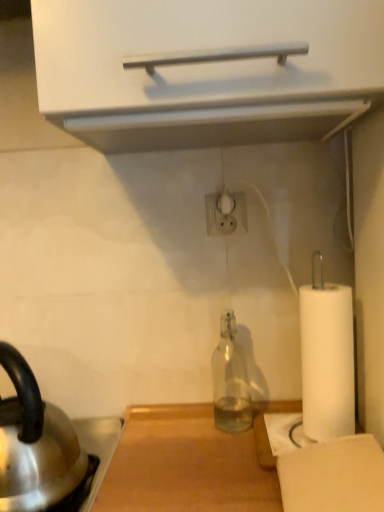
Describe the element at coordinates (35, 444) in the screenshot. I see `shiny metallic kettle at lower left` at that location.

Identify the location of shiny metallic kettle at lower left. This screenshot has width=384, height=512. (35, 444).

In order to face shiny metallic kettle at lower left, should I rotate leftwards or rightwards?

To face it directly, rotate left by 22.222 degrees.

Find the location of a particular element. The height and width of the screenshot is (512, 384). transparent glass bottle at center is located at coordinates click(x=230, y=380).

What do you see at coordinates (230, 380) in the screenshot?
I see `transparent glass bottle at center` at bounding box center [230, 380].

The image size is (384, 512). In order to click on shiny metallic kettle at lower left in this screenshot , I will do `click(35, 444)`.

From the picture: Does shiny metallic kettle at lower left appear on the right side of transparent glass bottle at center?

In fact, shiny metallic kettle at lower left is to the left of transparent glass bottle at center.

Is shiny metallic kettle at lower left positioned before transparent glass bottle at center?

Yes, shiny metallic kettle at lower left is closer to the viewer.

Does point (18, 507) come in front of point (240, 375)?

Yes, it is.

From the image's perspective, which one is positioned lower, shiny metallic kettle at lower left or transparent glass bottle at center?

From the image's view, shiny metallic kettle at lower left is below.

From a real-world perspective, between shiny metallic kettle at lower left and transparent glass bottle at center, who is vertically lower?

From a 3D spatial view, transparent glass bottle at center is below.

Is shiny metallic kettle at lower left wider than transparent glass bottle at center?

Yes.

Which of these two, shiny metallic kettle at lower left or transparent glass bottle at center, stands shorter?

With less height is transparent glass bottle at center.

In the scene shown: Is shiny metallic kettle at lower left smaller than transparent glass bottle at center?

No, shiny metallic kettle at lower left is not smaller than transparent glass bottle at center.

Is shiny metallic kettle at lower left inside the boundaries of transparent glass bottle at center, or outside?

The correct answer is: outside.

Looking at this image, is shiny metallic kettle at lower left far from transparent glass bottle at center?

shiny metallic kettle at lower left is near transparent glass bottle at center, not far away.

Is shiny metallic kettle at lower left positioned with its back to transparent glass bottle at center?

Yes, shiny metallic kettle at lower left's orientation is away from transparent glass bottle at center.

Identify the location of bottle below the shiny metallic kettle at lower left (from a real-world perspective). Image resolution: width=384 pixels, height=512 pixels. (230, 380).

Does transparent glass bottle at center appear on the right side of shiny metallic kettle at lower left?

Correct, you'll find transparent glass bottle at center to the right of shiny metallic kettle at lower left.

Considering the positions of objects transparent glass bottle at center and shiny metallic kettle at lower left in the image provided, who is in front, transparent glass bottle at center or shiny metallic kettle at lower left?

shiny metallic kettle at lower left is closer to the camera.

Does point (239, 406) appear closer or farther from the camera than point (80, 464)?

Point (239, 406) is positioned farther from the camera compared to point (80, 464).

From the picture: From the image's perspective, is transparent glass bottle at center above shiny metallic kettle at lower left?

Indeed, from the image's perspective, transparent glass bottle at center is shown above shiny metallic kettle at lower left.

From a real-world perspective, who is located higher, transparent glass bottle at center or shiny metallic kettle at lower left?

shiny metallic kettle at lower left is physically above.

Is transparent glass bottle at center wider or thinner than shiny metallic kettle at lower left?

Considering their sizes, transparent glass bottle at center looks slimmer than shiny metallic kettle at lower left.

In terms of height, does transparent glass bottle at center look taller or shorter compared to shiny metallic kettle at lower left?

Clearly, transparent glass bottle at center is shorter compared to shiny metallic kettle at lower left.

Considering the relative sizes of transparent glass bottle at center and shiny metallic kettle at lower left in the image provided, is transparent glass bottle at center smaller than shiny metallic kettle at lower left?

Yes, transparent glass bottle at center is smaller than shiny metallic kettle at lower left.

Is transparent glass bottle at center inside or outside of shiny metallic kettle at lower left?

transparent glass bottle at center is not inside shiny metallic kettle at lower left, it's outside.

In the scene shown: Is transparent glass bottle at center not near shiny metallic kettle at lower left?

No.

Is shiny metallic kettle at lower left at the back of transparent glass bottle at center?

No, transparent glass bottle at center's orientation is not away from shiny metallic kettle at lower left.

What's the angular difference between transparent glass bottle at center and shiny metallic kettle at lower left's facing directions?

transparent glass bottle at center and shiny metallic kettle at lower left are facing 39.7 degrees away from each other.

You are a GUI agent. You are given a task and a screenshot of the screen. Output one action in this format:
    pyautogui.click(x=<x>, y=<y>)
    Task: Click on the kettle below the transparent glass bottle at center (from the image's perspective)
    Image resolution: width=384 pixels, height=512 pixels.
    Given the screenshot: What is the action you would take?
    pyautogui.click(x=35, y=444)

This screenshot has width=384, height=512. Find the location of `kettle in front of the transparent glass bottle at center`. kettle in front of the transparent glass bottle at center is located at coordinates (35, 444).

Where is `kettle on the left side of transparent glass bottle at center`? This screenshot has height=512, width=384. kettle on the left side of transparent glass bottle at center is located at coordinates (35, 444).